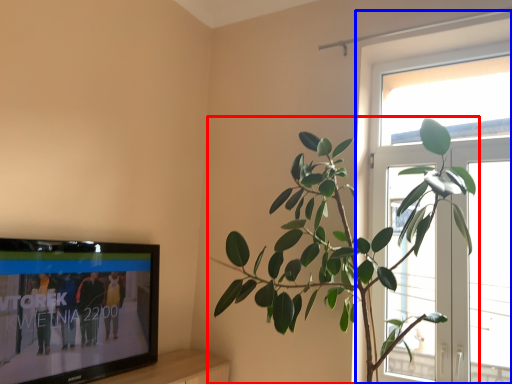
Question: Among these objects, which one is nearest to the camera, houseplant (highlighted by a red box) or window (highlighted by a blue box)?

Choices:
 (A) houseplant
 (B) window

Answer: (A)